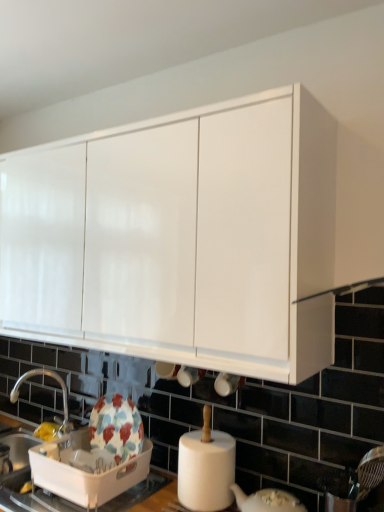
Question: Is silver metallic tap at lower left at the back of white glossy cabinet at upper center?

Choices:
 (A) yes
 (B) no

Answer: (B)

Question: From a real-world perspective, is white glossy cabinet at upper center located beneath silver metallic tap at lower left?

Choices:
 (A) yes
 (B) no

Answer: (B)

Question: Could you tell me if white glossy cabinet at upper center is turned towards silver metallic tap at lower left?

Choices:
 (A) yes
 (B) no

Answer: (B)

Question: Does white glossy cabinet at upper center appear on the right side of silver metallic tap at lower left?

Choices:
 (A) no
 (B) yes

Answer: (B)

Question: Considering the relative sizes of white glossy cabinet at upper center and silver metallic tap at lower left in the image provided, is white glossy cabinet at upper center bigger than silver metallic tap at lower left?

Choices:
 (A) no
 (B) yes

Answer: (B)

Question: Is silver metallic tap at lower left inside or outside of floral ceramic dish drainer at lower left?

Choices:
 (A) inside
 (B) outside

Answer: (B)

Question: From a real-world perspective, is silver metallic tap at lower left above or below floral ceramic dish drainer at lower left?

Choices:
 (A) below
 (B) above

Answer: (B)

Question: Based on their sizes in the image, would you say silver metallic tap at lower left is bigger or smaller than floral ceramic dish drainer at lower left?

Choices:
 (A) small
 (B) big

Answer: (A)

Question: Is point (49, 373) closer or farther from the camera than point (148, 449)?

Choices:
 (A) farther
 (B) closer

Answer: (A)

Question: In the image, is white glossy cabinet at upper center positioned in front of or behind floral ceramic dish drainer at lower left?

Choices:
 (A) front
 (B) behind

Answer: (A)

Question: Considering the positions of white glossy cabinet at upper center and floral ceramic dish drainer at lower left in the image, is white glossy cabinet at upper center taller or shorter than floral ceramic dish drainer at lower left?

Choices:
 (A) short
 (B) tall

Answer: (B)

Question: Based on their sizes in the image, would you say white glossy cabinet at upper center is bigger or smaller than floral ceramic dish drainer at lower left?

Choices:
 (A) small
 (B) big

Answer: (B)

Question: Considering the positions of white glossy cabinet at upper center and floral ceramic dish drainer at lower left in the image, is white glossy cabinet at upper center wider or thinner than floral ceramic dish drainer at lower left?

Choices:
 (A) wide
 (B) thin

Answer: (A)

Question: Considering the relative positions of floral ceramic dish drainer at lower left and silver metallic tap at lower left in the image provided, is floral ceramic dish drainer at lower left to the left or to the right of silver metallic tap at lower left?

Choices:
 (A) left
 (B) right

Answer: (B)

Question: From their relative heights in the image, would you say floral ceramic dish drainer at lower left is taller or shorter than silver metallic tap at lower left?

Choices:
 (A) short
 (B) tall

Answer: (A)